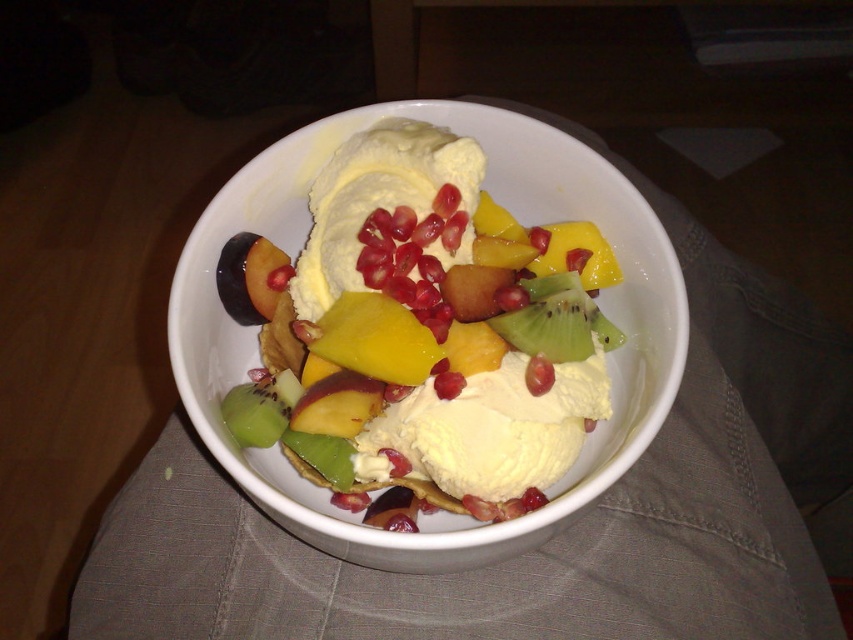
Question: Which is farther from the green matte kiwi at center?

Choices:
 (A) smooth creamy ice cream at center
 (B) shiny red pomegranate at center
 (C) red glossy pomegranate at center

Answer: (A)

Question: Is shiny red pomegranate at center closer to camera compared to red glossy pomegranate at center?

Choices:
 (A) no
 (B) yes

Answer: (B)

Question: Estimate the real-world distances between objects in this image. Which object is farther from the smooth creamy ice cream at center?

Choices:
 (A) shiny red pomegranate at center
 (B) green matte kiwi at center

Answer: (A)

Question: Which point is farther to the camera?

Choices:
 (A) red glossy pomegranate at center
 (B) smooth creamy ice cream at center

Answer: (B)

Question: Is green matte kiwi at center positioned before red glossy pomegranate at center?

Choices:
 (A) no
 (B) yes

Answer: (A)

Question: Does green matte kiwi at center have a smaller size compared to shiny red pomegranate at center?

Choices:
 (A) yes
 (B) no

Answer: (B)